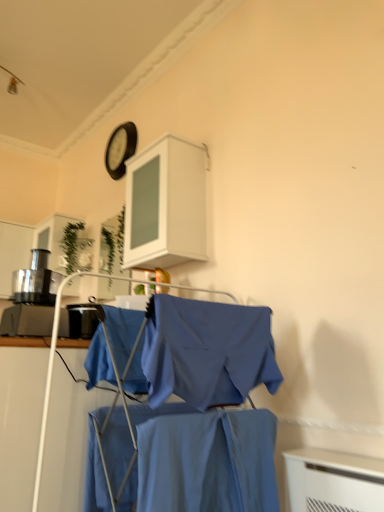
Question: From their relative heights in the image, would you say white matte cabinet at upper center is taller or shorter than black matte clock at upper center?

Choices:
 (A) short
 (B) tall

Answer: (B)

Question: Would you say white matte cabinet at upper center is to the left or to the right of black matte clock at upper center in the picture?

Choices:
 (A) left
 (B) right

Answer: (B)

Question: Estimate the real-world distances between objects in this image. Which object is closer to the green matte plant at upper center, arranged as the first plant when viewed from the left?

Choices:
 (A) white matte cabinet at upper center
 (B) blue fabric shirt at center
 (C) blue cotton shirt at center, which is the first fabric from back to front
 (D) black matte clock at upper center
 (E) smooth cotton shirt at center, the 1th fabric positioned from the right

Answer: (D)

Question: Which is nearer to the green glass plant at upper center, which is the 1th plant in right-to-left order?

Choices:
 (A) black matte clock at upper center
 (B) smooth cotton shirt at center, the 2th fabric from the left
 (C) green matte plant at upper center, which is counted as the second plant, starting from the right
 (D) blue fabric shirt at center
 (E) blue cotton shirt at center, the second fabric from the front

Answer: (C)